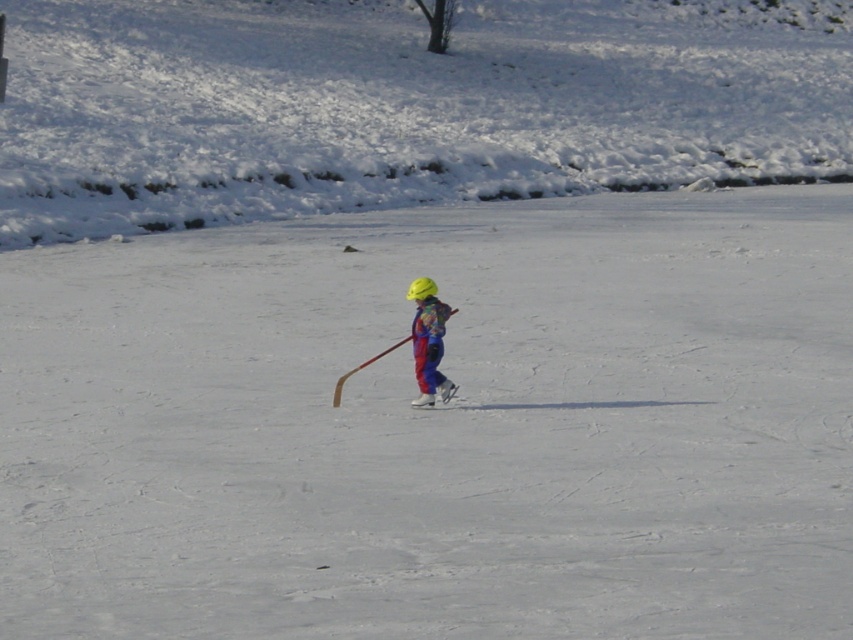
Based on the coordinates provided, where is the multicolored fabric child at center located in the image?

The multicolored fabric child at center is located at point coordinates of (428, 340).

You are a photographer trying to capture a photo of the multicolored fabric child at center and the white matte ski at center. Based on their sizes, which object should you focus on first if you want to ensure both are in frame without zooming in or out?

The multicolored fabric child at center is taller than the white matte ski at center, so you should focus on the multicolored fabric child at center first to ensure both fit in the frame without zooming.

You are a drone operator trying to capture a photo of the multicolored fabric child at center. The camera is positioned at point A, which has coordinates of 0.4, 0.5. The target point for the photo is point B with coordinates (428, 340). What direction should you move the drone to get closer to the multicolored fabric child at center?

The point B at (428, 340) is to the right of point A at 0.4, 0.5. Move the drone to the right to get closer to the multicolored fabric child at center.